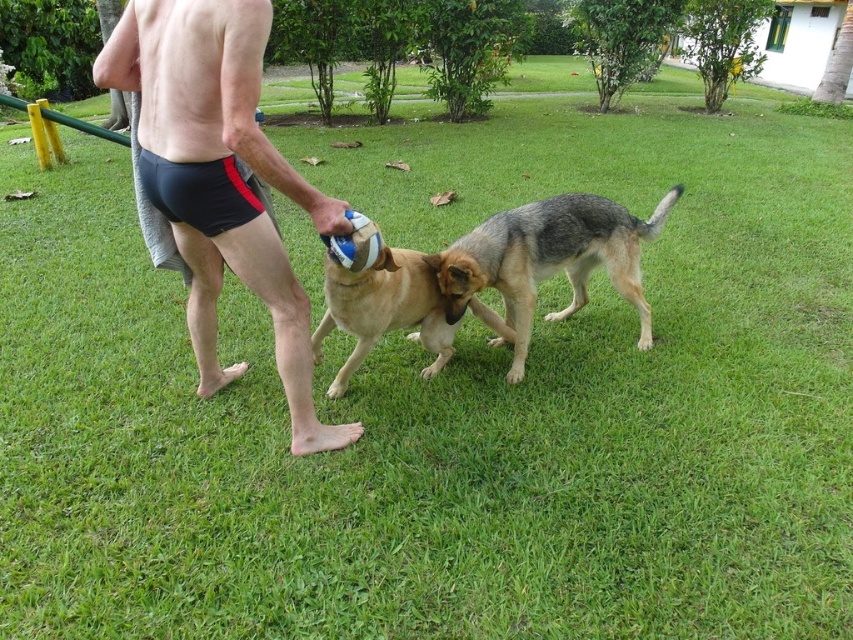
Question: Which of the following is the farthest from the observer?

Choices:
 (A) gray-furred dog at center
 (B) golden fur dog at center
 (C) black matte shorts at center

Answer: (A)

Question: Which object is the farthest from the black matte shorts at center?

Choices:
 (A) golden fur dog at center
 (B) gray-furred dog at center

Answer: (B)

Question: Does black matte shorts at center have a larger size compared to gray-furred dog at center?

Choices:
 (A) yes
 (B) no

Answer: (A)

Question: Does black matte shorts at center appear on the left side of golden fur dog at center?

Choices:
 (A) yes
 (B) no

Answer: (A)

Question: Is black matte shorts at center above golden fur dog at center?

Choices:
 (A) yes
 (B) no

Answer: (A)

Question: Based on their relative distances, which object is nearer to the gray-furred dog at center?

Choices:
 (A) black matte shorts at center
 (B) golden fur dog at center

Answer: (B)